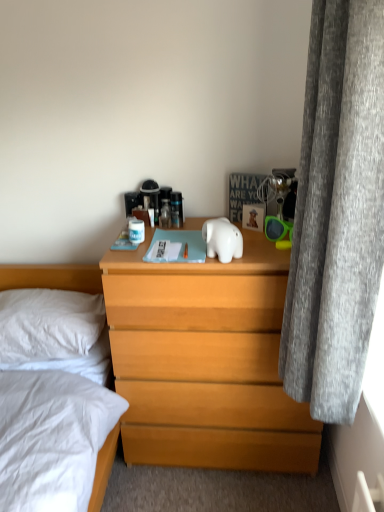
The image size is (384, 512). I want to click on light brown wooden chest of drawers at center, so click(205, 362).

The image size is (384, 512). What do you see at coordinates (48, 325) in the screenshot? I see `white soft pillow at left` at bounding box center [48, 325].

What do you see at coordinates (222, 239) in the screenshot?
I see `white glossy elephant at center` at bounding box center [222, 239].

What do you see at coordinates (165, 214) in the screenshot? I see `clear plastic bottle at center` at bounding box center [165, 214].

Identify the location of gray fabric curtain at right. Image resolution: width=384 pixels, height=512 pixels. (337, 211).

The height and width of the screenshot is (512, 384). In order to click on light brown wooden chest of drawers at center in this screenshot , I will do `click(205, 362)`.

Between point (182, 283) and point (228, 233), which one is positioned behind?

The point (182, 283) is farther.

From the image's perspective, is light brown wooden chest of drawers at center over white glossy elephant at center?

No.

Can you confirm if light brown wooden chest of drawers at center is smaller than white glossy elephant at center?

No, light brown wooden chest of drawers at center is not smaller than white glossy elephant at center.

Which object is positioned more to the left, light brown wooden chest of drawers at center or white glossy elephant at center?

Positioned to the left is white glossy elephant at center.

Between light brown wooden chest of drawers at center and gray fabric curtain at right, which one is positioned in front?

gray fabric curtain at right is closer to the camera.

Is light brown wooden chest of drawers at center with gray fabric curtain at right?

No, light brown wooden chest of drawers at center is not in contact with gray fabric curtain at right.

Could you tell me if light brown wooden chest of drawers at center is turned towards gray fabric curtain at right?

No.

Find the location of a particular element. The image size is (384, 512). curtain above the light brown wooden chest of drawers at center (from the image's perspective) is located at coordinates (337, 211).

At what (x,y) coordinates should I click in order to perform the action: click on toiletry on the left of white glossy elephant at center. Please return your answer as a coordinate pair (x, y). The height and width of the screenshot is (512, 384). Looking at the image, I should click on (165, 214).

In the image, is white glossy elephant at center on the left side or the right side of clear plastic bottle at center?

white glossy elephant at center is to the right of clear plastic bottle at center.

From the picture: From the image's perspective, is white glossy elephant at center over clear plastic bottle at center?

No, from the image's perspective, white glossy elephant at center is not on top of clear plastic bottle at center.

Considering the positions of point (218, 231) and point (164, 218), is point (218, 231) closer or farther from the camera than point (164, 218)?

Point (218, 231) appears to be closer to the viewer than point (164, 218).

Can you confirm if gray fabric curtain at right is smaller than white glossy elephant at center?

Incorrect, gray fabric curtain at right is not smaller in size than white glossy elephant at center.

From the picture: Between gray fabric curtain at right and white glossy elephant at center, which one is positioned in front?

gray fabric curtain at right.

Is point (339, 393) positioned after point (222, 262)?

No, (339, 393) is in front of (222, 262).

Who is taller, gray fabric curtain at right or white glossy elephant at center?

With more height is gray fabric curtain at right.

Is the position of clear plastic bottle at center less distant than that of white glossy elephant at center?

No, it is behind white glossy elephant at center.

Is white glossy elephant at center located within clear plastic bottle at center?

No, white glossy elephant at center is not a part of clear plastic bottle at center.

Which of these two, clear plastic bottle at center or white glossy elephant at center, stands taller?

Standing taller between the two is clear plastic bottle at center.

Considering the positions of points (169, 226) and (219, 250), is point (169, 226) closer to camera compared to point (219, 250)?

No, it is behind (219, 250).

Is gray fabric curtain at right turned away from white soft pillow at left?

No, gray fabric curtain at right's orientation is not away from white soft pillow at left.

Is gray fabric curtain at right wider or thinner than white soft pillow at left?

Clearly, gray fabric curtain at right has less width compared to white soft pillow at left.

From a real-world perspective, which is physically above, gray fabric curtain at right or white soft pillow at left?

In real-world perspective, gray fabric curtain at right is above.

Is white soft pillow at left further to camera compared to light brown wooden chest of drawers at center?

Yes.

Is white soft pillow at left taller or shorter than light brown wooden chest of drawers at center?

In the image, white soft pillow at left appears to be shorter than light brown wooden chest of drawers at center.

Is white soft pillow at left oriented towards light brown wooden chest of drawers at center?

No, white soft pillow at left is not oriented towards light brown wooden chest of drawers at center.

Locate an element on the screen. the chest of drawers that appears behind the white glossy elephant at center is located at coordinates (205, 362).

Where is `curtain in front of the light brown wooden chest of drawers at center`? curtain in front of the light brown wooden chest of drawers at center is located at coordinates (337, 211).

From the image, which object appears to be nearer to white glossy elephant at center, light brown wooden chest of drawers at center or gray fabric curtain at right?

gray fabric curtain at right lies closer to white glossy elephant at center than the other object.

Which object lies further to the anchor point white soft pillow at left, gray fabric curtain at right or clear plastic bottle at center?

Based on the image, gray fabric curtain at right appears to be further to white soft pillow at left.

When comparing their distances from gray fabric curtain at right, does clear plastic bottle at center or white soft pillow at left seem closer?

clear plastic bottle at center is closer to gray fabric curtain at right.

Looking at the image, which one is located closer to white glossy elephant at center, light brown wooden chest of drawers at center or clear plastic bottle at center?

The object closer to white glossy elephant at center is clear plastic bottle at center.

Which object lies further to the anchor point clear plastic bottle at center, light brown wooden chest of drawers at center or white glossy elephant at center?

light brown wooden chest of drawers at center lies further to clear plastic bottle at center than the other object.

Considering their positions, is clear plastic bottle at center positioned further to light brown wooden chest of drawers at center than white soft pillow at left?

Among the two, clear plastic bottle at center is located further to light brown wooden chest of drawers at center.

Estimate the real-world distances between objects in this image. Which object is closer to gray fabric curtain at right, white glossy elephant at center or clear plastic bottle at center?

white glossy elephant at center is closer to gray fabric curtain at right.

Which object lies further to the anchor point white glossy elephant at center, clear plastic bottle at center or white soft pillow at left?

Based on the image, white soft pillow at left appears to be further to white glossy elephant at center.

Find the location of a particular element. the chest of drawers located between gray fabric curtain at right and clear plastic bottle at center in the depth direction is located at coordinates (205, 362).

The image size is (384, 512). Identify the location of toiletry between white soft pillow at left and white glossy elephant at center in the horizontal direction. click(x=165, y=214).

The height and width of the screenshot is (512, 384). Find the location of `animal between gray fabric curtain at right and light brown wooden chest of drawers at center in the front-back direction`. animal between gray fabric curtain at right and light brown wooden chest of drawers at center in the front-back direction is located at coordinates (222, 239).

This screenshot has width=384, height=512. I want to click on the chest of drawers located between white soft pillow at left and gray fabric curtain at right in the left-right direction, so click(205, 362).